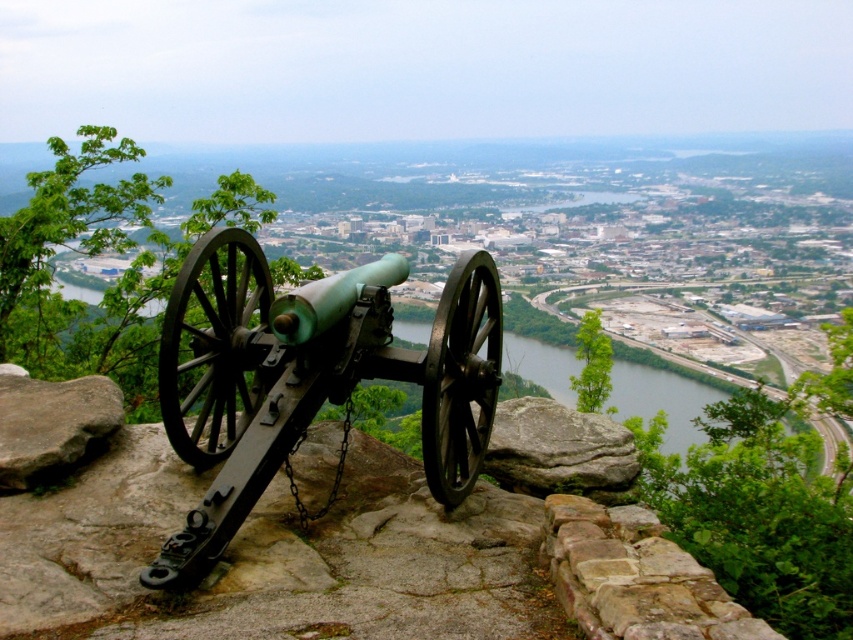
Does green matte cannon at center come behind greenish-gray water at center?

No, green matte cannon at center is in front of greenish-gray water at center.

Which is more to the left, green matte cannon at center or greenish-gray water at center?

greenish-gray water at center

Where is `green matte cannon at center`? The height and width of the screenshot is (640, 853). green matte cannon at center is located at coordinates (309, 378).